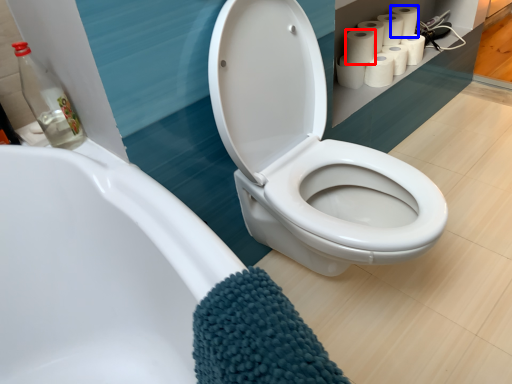
Question: Among these objects, which one is farthest to the camera, paper towel (highlighted by a red box) or toilet paper (highlighted by a blue box)?

Choices:
 (A) paper towel
 (B) toilet paper

Answer: (B)